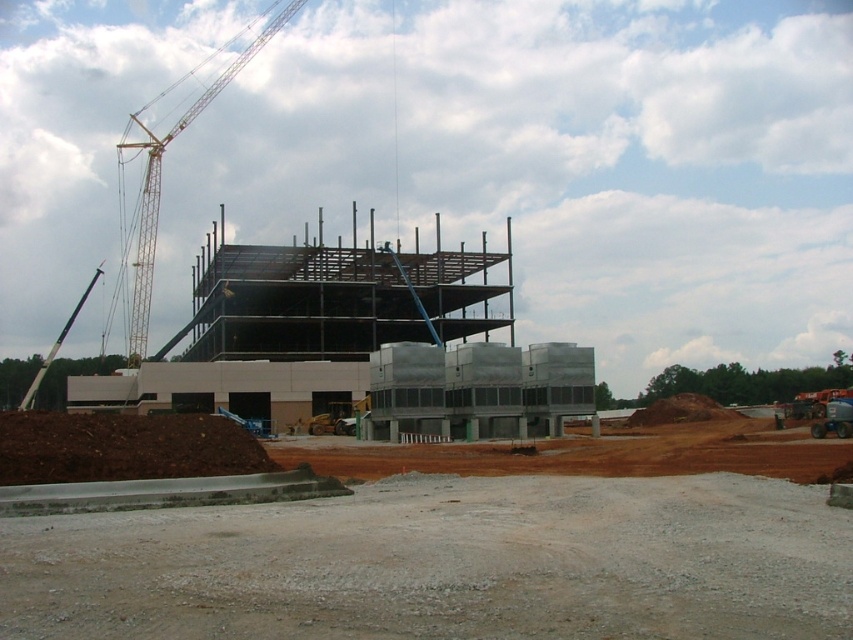
Is gray gravel dirt track at lower center above yellow metallic crane at upper left?

Incorrect, gray gravel dirt track at lower center is not positioned above yellow metallic crane at upper left.

Based on the photo, which is below, gray gravel dirt track at lower center or yellow metallic crane at upper left?

gray gravel dirt track at lower center is below.

Between point (836, 557) and point (268, 29), which one is positioned in front?

Positioned in front is point (836, 557).

The height and width of the screenshot is (640, 853). I want to click on gray gravel dirt track at lower center, so click(445, 564).

Does point (451, 452) come in front of point (399, 440)?

Yes, point (451, 452) is in front of point (399, 440).

Based on the photo, who is lower down, brown sandy dirt at lower center or white plastic website at center?

white plastic website at center is lower down.

Where is `brown sandy dirt at lower center`? The height and width of the screenshot is (640, 853). brown sandy dirt at lower center is located at coordinates (592, 452).

Consider the image. Measure the distance between point (135,260) and camera.

The distance of point (135,260) from camera is 253.55 meters.

Is yellow metallic crane at upper left wider than white plastic website at center?

Indeed, yellow metallic crane at upper left has a greater width compared to white plastic website at center.

Is point (236, 60) behind point (416, 435)?

Yes, point (236, 60) is behind point (416, 435).

Find the location of a particular element. The image size is (853, 640). yellow metallic crane at upper left is located at coordinates (160, 182).